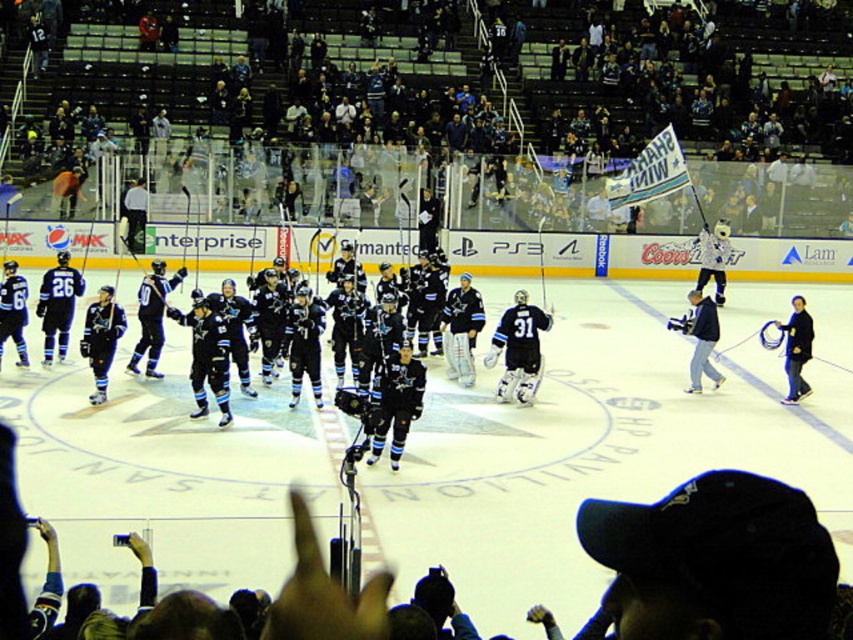
You are standing at the center of the ice rink and want to know how far the point marked at coordinates (657, 204) is from where you are standing. Can you determine the distance?

The point marked at coordinates (657, 204) is 84.68 feet away from the camera, so if you are standing at the center of the ice rink, the distance would depend on your exact position relative to the camera. However, the given information states it is 84.68 feet from the camera.

You are a photographer at the ice hockey rink. You need to take a photo that includes both the dark blue jersey at upper center and the black jersey at center. Based on their positions, which jersey should you adjust your camera angle to ensure both are in frame?

The dark blue jersey at upper center is to the right of the black jersey at center. To capture both in the frame, adjust your camera angle to the right side so that both the dark blue jersey at upper center and the black jersey at center are included.